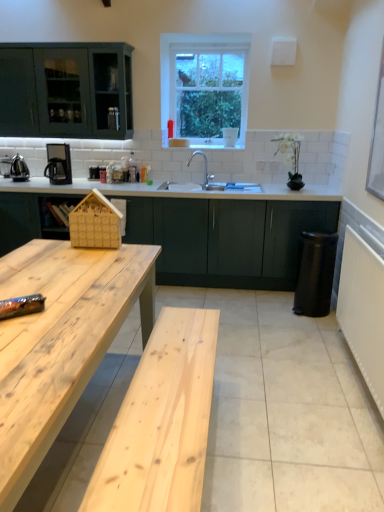
Where is `vacant area in front of wooden house at center`? The image size is (384, 512). vacant area in front of wooden house at center is located at coordinates (93, 257).